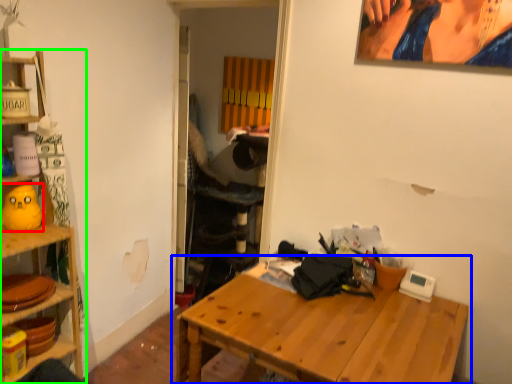
Question: Estimate the real-world distances between objects in this image. Which object is farther from toy (highlighted by a red box), table (highlighted by a blue box) or shelf (highlighted by a green box)?

Choices:
 (A) table
 (B) shelf

Answer: (A)